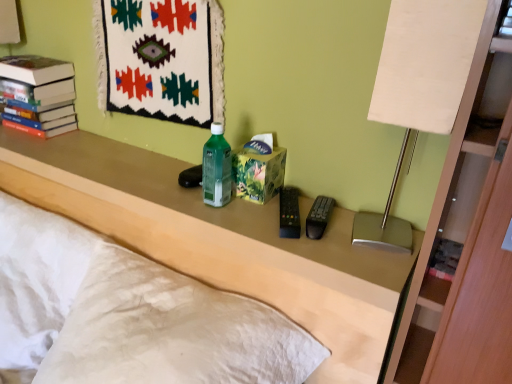
Locate an element on the screen. The height and width of the screenshot is (384, 512). free space above matte plastic remote control at center (from a real-world perspective) is located at coordinates (152, 174).